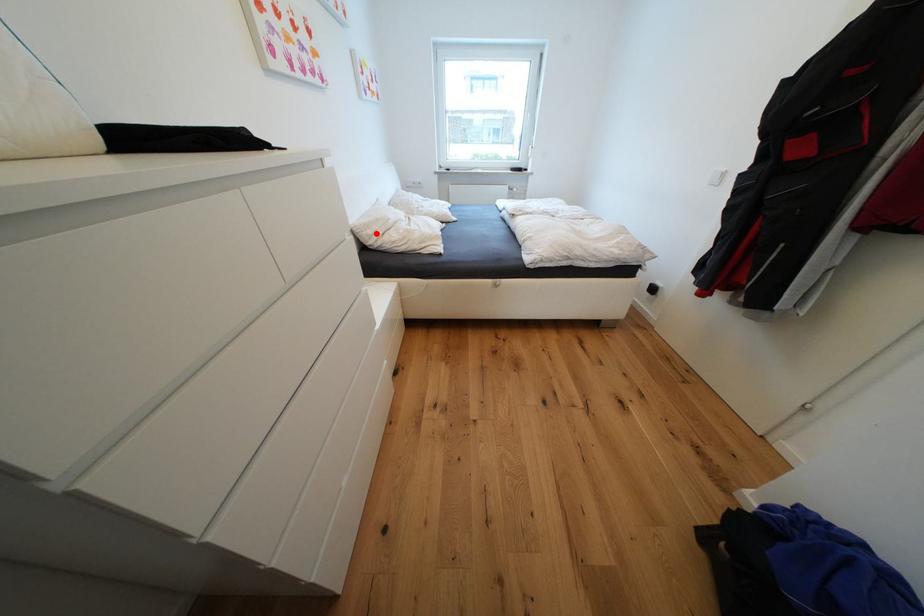
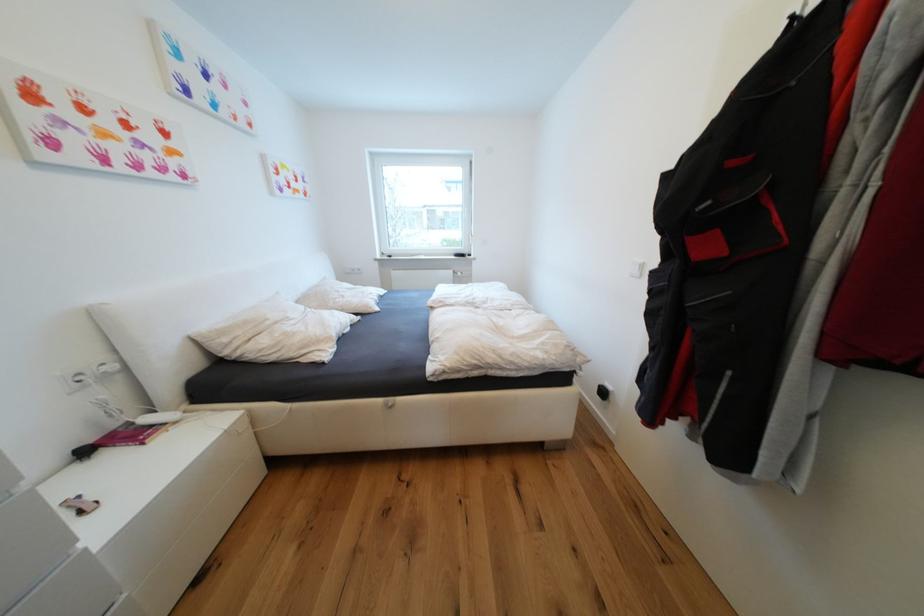
Find the pixel in the second image that matches the highlighted location in the first image.

(233, 341)